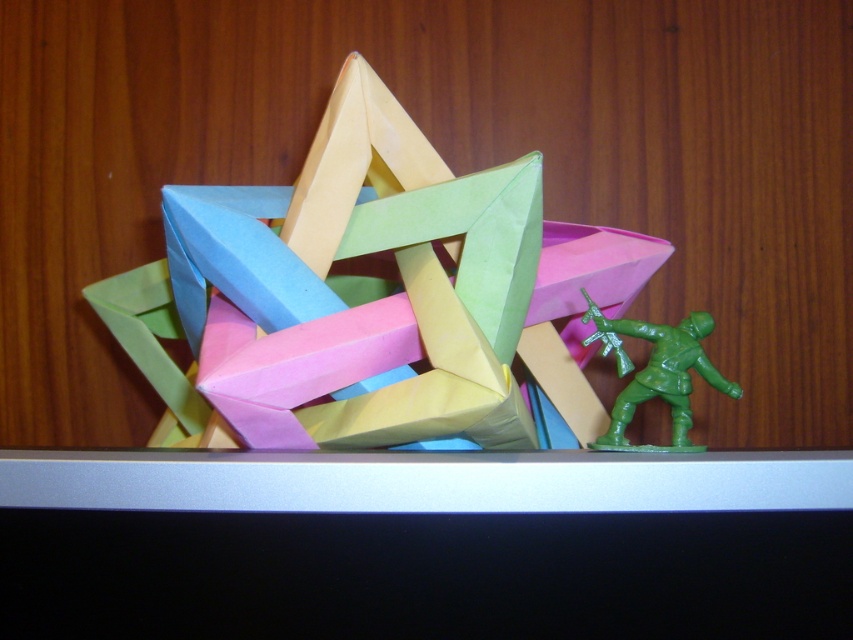
You are a child who wants to place a small sticker between the pastel paper star at center and the green plastic toy soldier at lower right. If the sticker is 3 inches wide, will it fit without overlapping either object?

The distance between the pastel paper star at center and the green plastic toy soldier at lower right is 4.61 inches. Since the sticker is 3 inches wide, it will fit between them without overlapping either object as there is enough space.